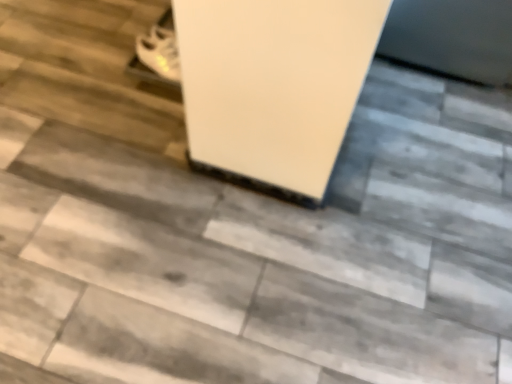
Question: Should I look upward or downward to see white matte shoes at upper left?

Choices:
 (A) down
 (B) up

Answer: (B)